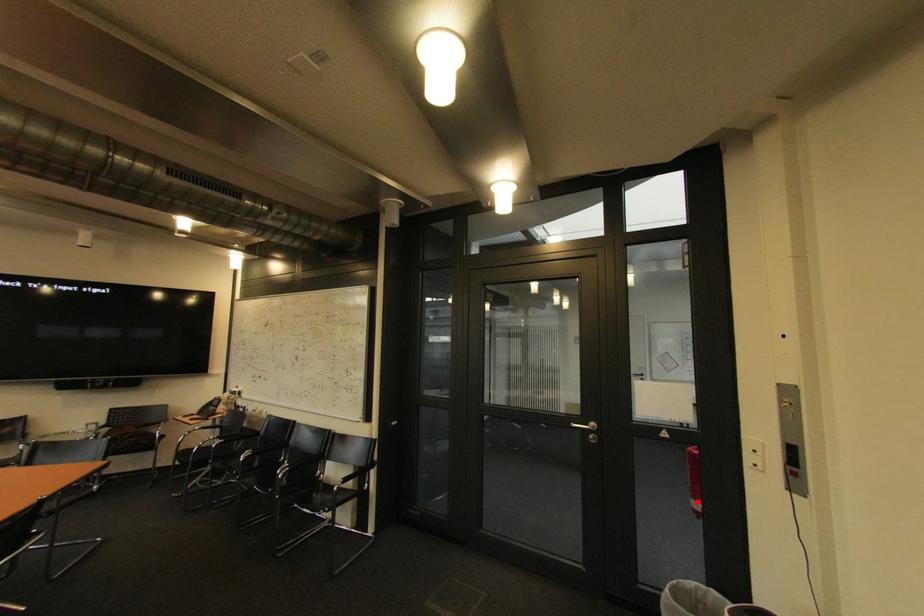
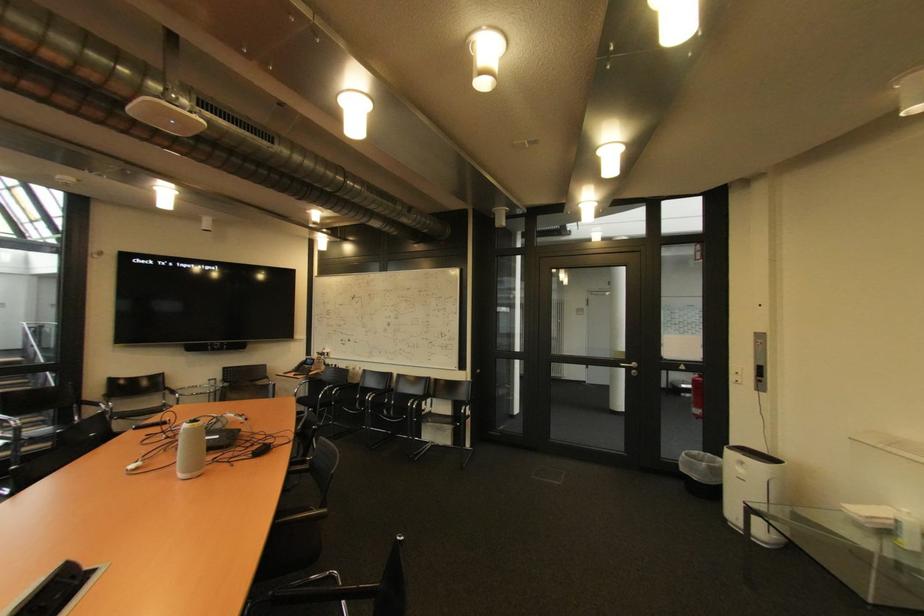
Question: A red point is marked in image1. In image2, is the corresponding 3D point closer to the camera or farther? Reply with the corresponding letter.

Choices:
 (A) The corresponding 3D point is closer.
 (B) The corresponding 3D point is farther.

Answer: (A)